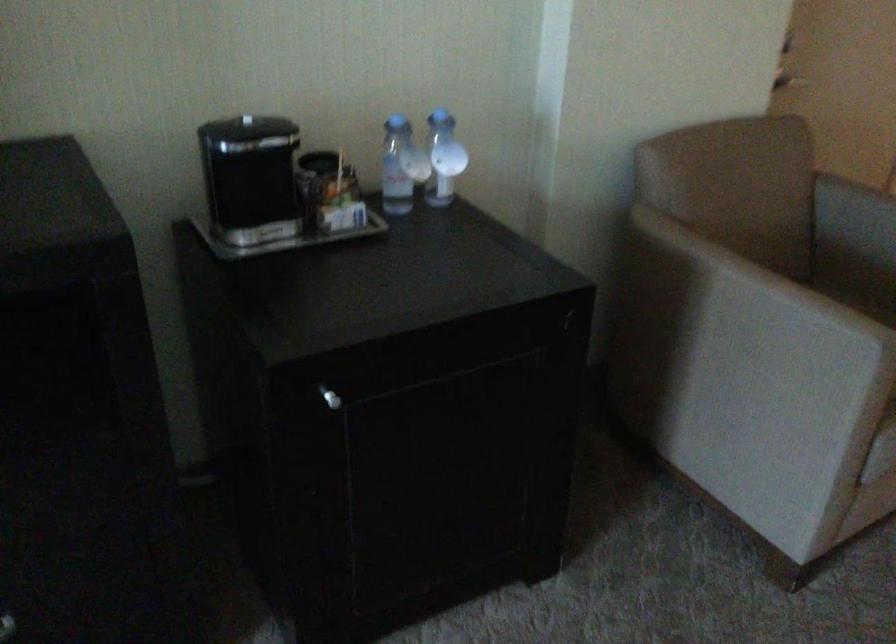
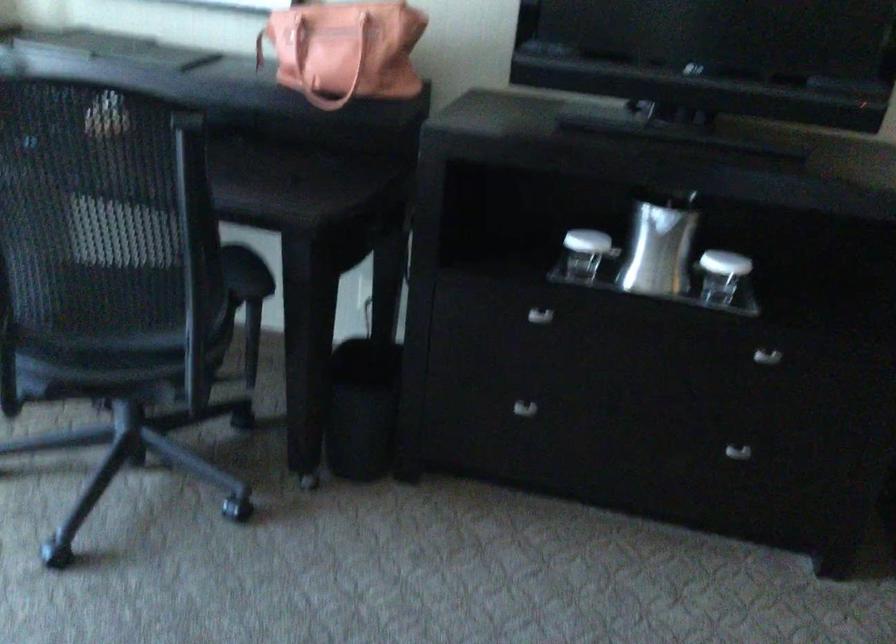
Question: The camera is either moving clockwise (left) or counter-clockwise (right) around the object. The first image is from the beginning of the video and the second image is from the end. Is the camera moving left or right when shooting the video?

Choices:
 (A) Left
 (B) Right

Answer: (B)